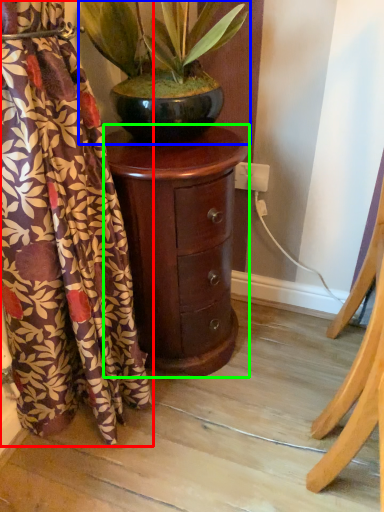
Question: Estimate the real-world distances between objects in this image. Which object is closer to curtain (highlighted by a red box), houseplant (highlighted by a blue box) or nightstand (highlighted by a green box)?

Choices:
 (A) houseplant
 (B) nightstand

Answer: (B)